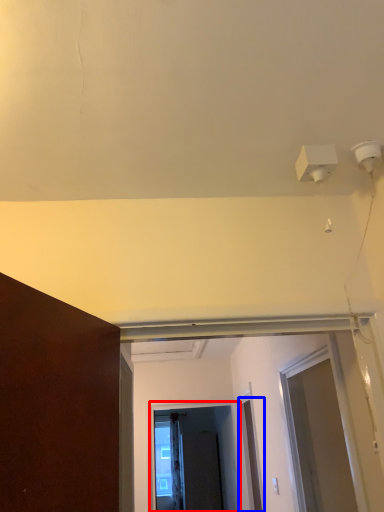
Question: Which of the following is the closest to the observer, screen door (highlighted by a red box) or door (highlighted by a blue box)?

Choices:
 (A) screen door
 (B) door

Answer: (B)